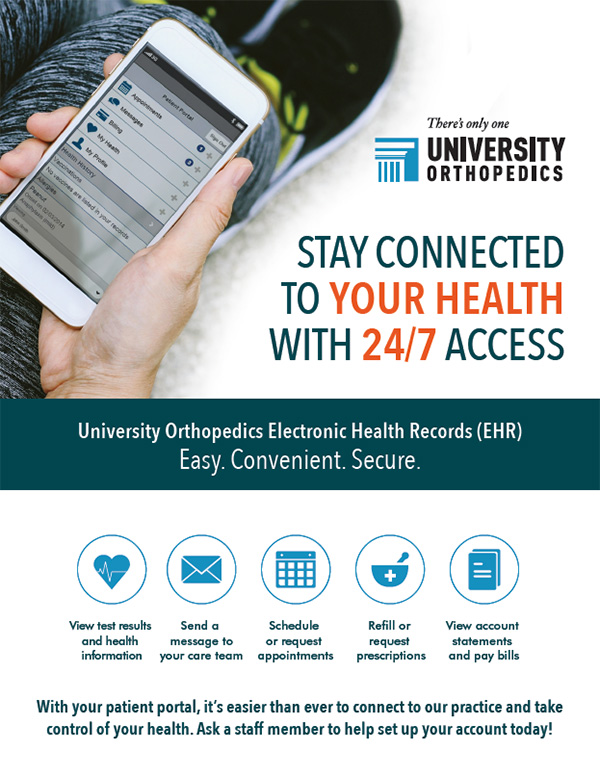
Find the location of a particular element. This screenshot has height=778, width=600. phone is located at coordinates (229, 82).